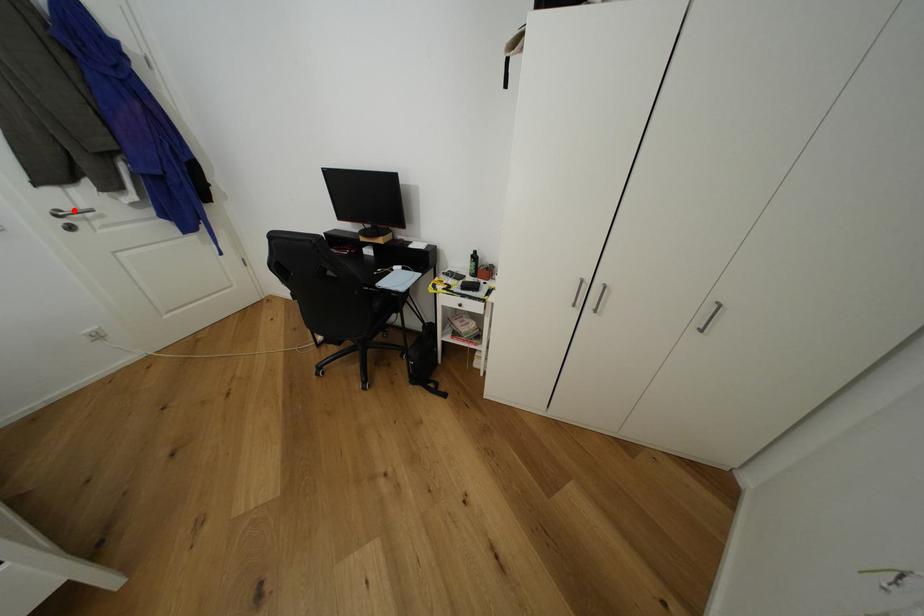
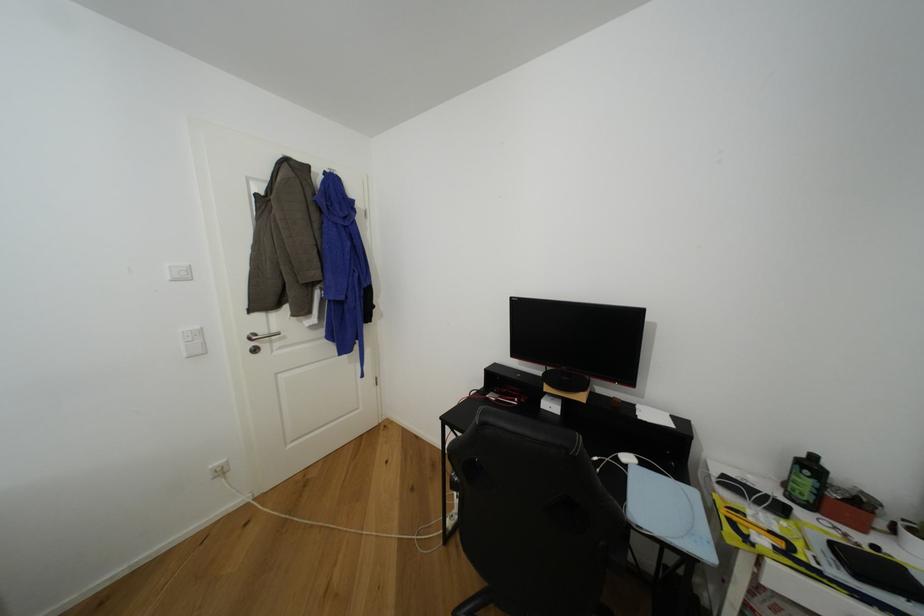
Question: I am providing you with two images of the same scene from different viewpoints. A red point is shown in image1. For the corresponding object point in image2, is it positioned nearer or farther from the camera?

Choices:
 (A) Nearer
 (B) Farther

Answer: (A)